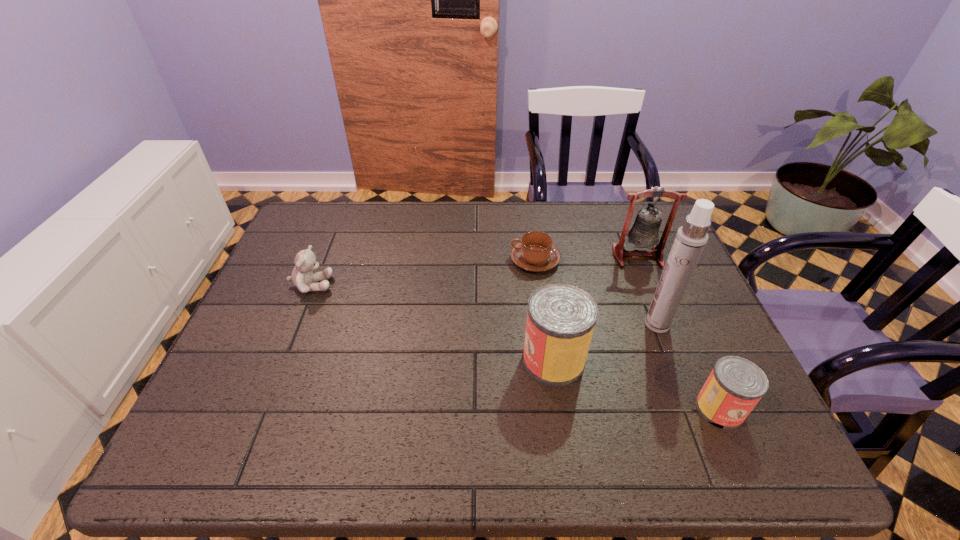
Image resolution: width=960 pixels, height=540 pixels. I want to click on blank space that satisfies the following two spatial constraints: 1. on the face of the nearer can; 2. on the right side of the teddy bear, so click(x=262, y=408).

Locate an element on the screen. free point that satisfies the following two spatial constraints: 1. on the face of the leftmost object; 2. on the left side of the third nearest object is located at coordinates (296, 325).

Locate an element on the screen. The height and width of the screenshot is (540, 960). vacant point that satisfies the following two spatial constraints: 1. on the face of the farther can; 2. on the right side of the teddy bear is located at coordinates (281, 360).